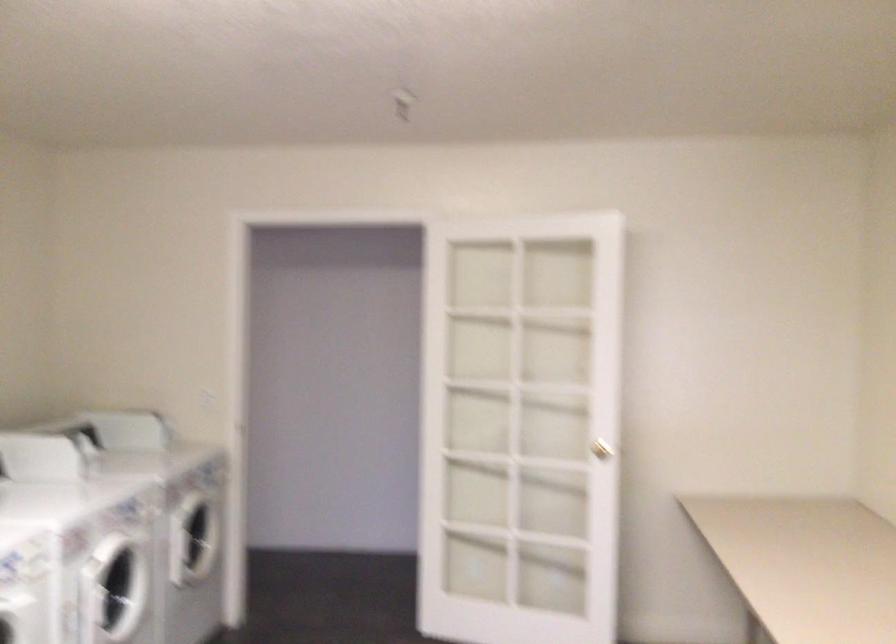
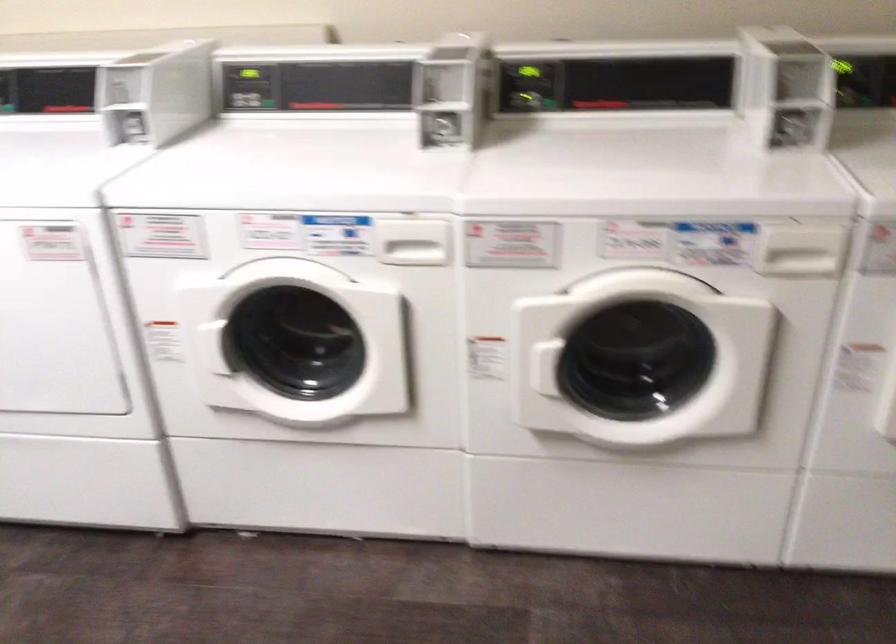
Find the pixel in the second image that matches (x=83, y=444) in the first image.

(794, 80)